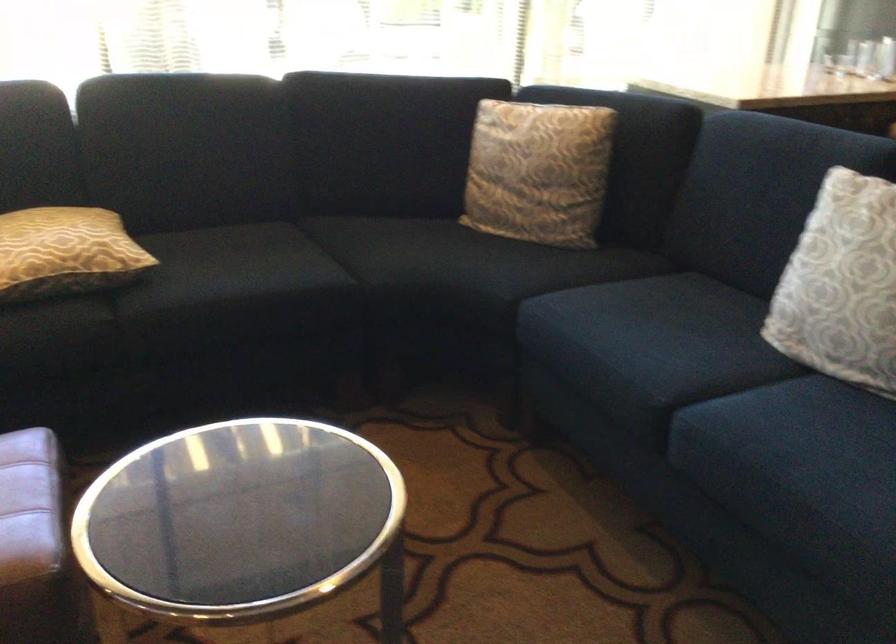
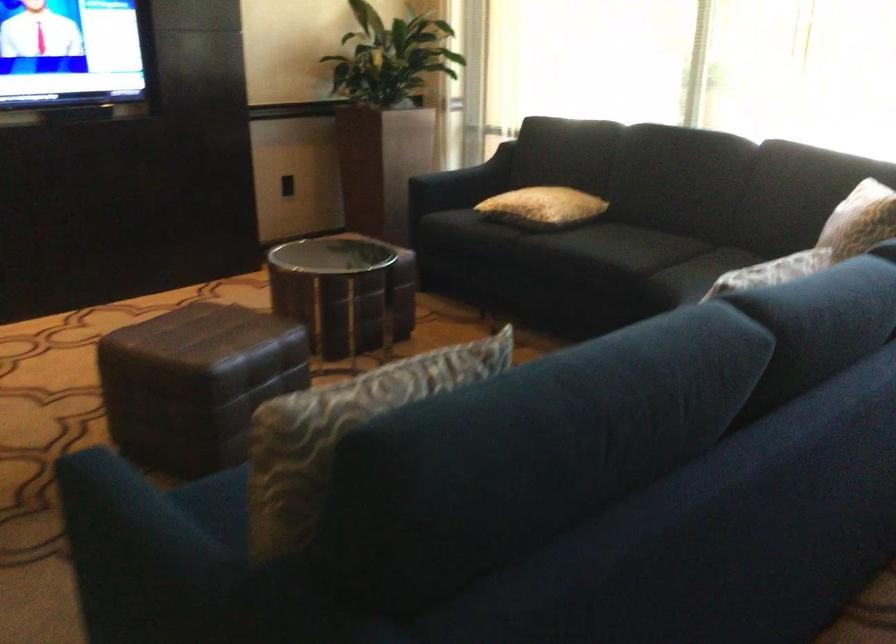
Where in the second image is the point corresponding to the point at 97,250 from the first image?

(543, 207)